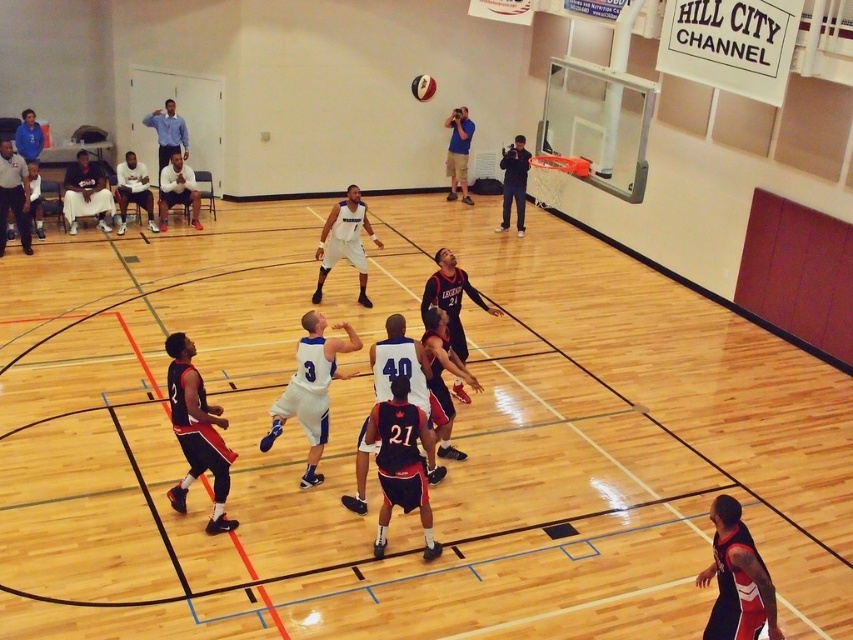
Question: Which of the following is the farthest from the observer?

Choices:
 (A) (355, 621)
 (B) (335, 339)
 (C) (418, 88)
 (D) (173, 372)

Answer: (C)

Question: Is white matte basketball player at center to the left of white shirt at center from the viewer's perspective?

Choices:
 (A) no
 (B) yes

Answer: (A)

Question: Which point appears farthest from the camera in this image?

Choices:
 (A) (430, 84)
 (B) (28, 161)

Answer: (A)

Question: Considering the real-world distances, which object is closest to the shiny orange basketball at center?

Choices:
 (A) blue fabric camera at upper center
 (B) black jersey at lower right
 (C) matte black basketball at upper left
 (D) dark blue jersey at center

Answer: (A)

Question: Can you confirm if dark blue jeans at upper right is bigger than blue fleece jacket at upper left?

Choices:
 (A) no
 (B) yes

Answer: (B)

Question: Is white jersey at center thinner than white shirt at center?

Choices:
 (A) no
 (B) yes

Answer: (A)